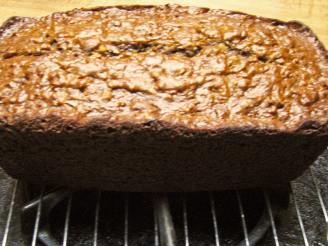
Where is `grey background countertop`? grey background countertop is located at coordinates (317, 230), (8, 188).